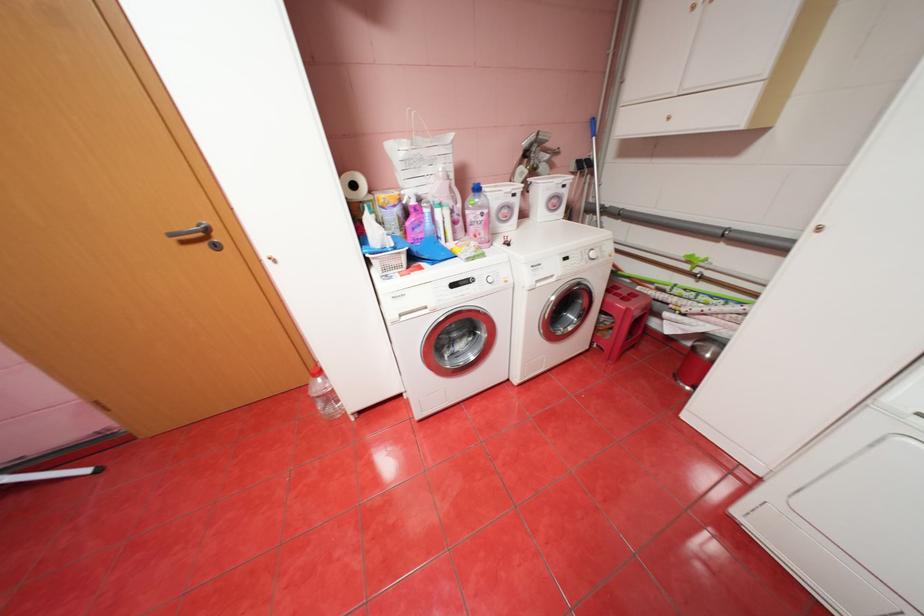
You are a GUI agent. You are given a task and a screenshot of the screen. Output one action in this format:
    pyautogui.click(x=<x>, y=<y>)
    Task: Click on the blue mop handle
    
    Given the screenshot: What is the action you would take?
    pyautogui.click(x=593, y=140)